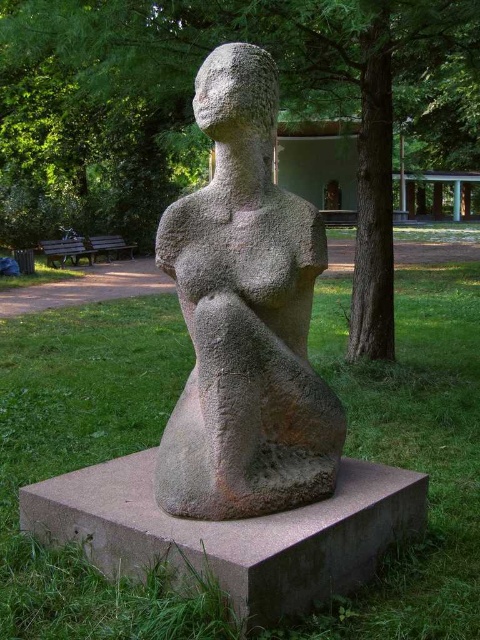
Does green grass at center appear on the left side of granite statue at center?

Indeed, green grass at center is positioned on the left side of granite statue at center.

The image size is (480, 640). In order to click on green grass at center in this screenshot , I will do `click(86, 460)`.

Which is in front, point (436, 308) or point (251, 225)?

Positioned in front is point (251, 225).

In order to click on green grass at center in this screenshot , I will do `click(86, 460)`.

The width and height of the screenshot is (480, 640). Find the location of `green grass at center`. green grass at center is located at coordinates (86, 460).

Can you confirm if green grass at center is wider than wooden park bench at left?

Yes, green grass at center is wider than wooden park bench at left.

Which is in front, point (90, 356) or point (69, 259)?

Point (90, 356) is in front.

Where is `green grass at center`? green grass at center is located at coordinates (86, 460).

Is the position of green grass at center more distant than that of wooden park bench at center?

That is False.

Can you confirm if green grass at center is positioned below wooden park bench at center?

Yes.

Which is behind, point (448, 321) or point (133, 243)?

The point (133, 243) is more distant.

Find the location of a particular element. This screenshot has height=640, width=480. green grass at center is located at coordinates (86, 460).